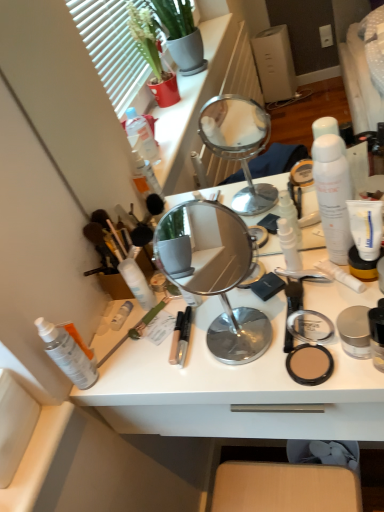
The height and width of the screenshot is (512, 384). Identify the location of vacant space that's between white matte spray can at left, marked as the fifth toiletry in a right-to-left arrangement, and white matte lotion at center, acting as the 2th toiletry starting from the right. (200, 316).